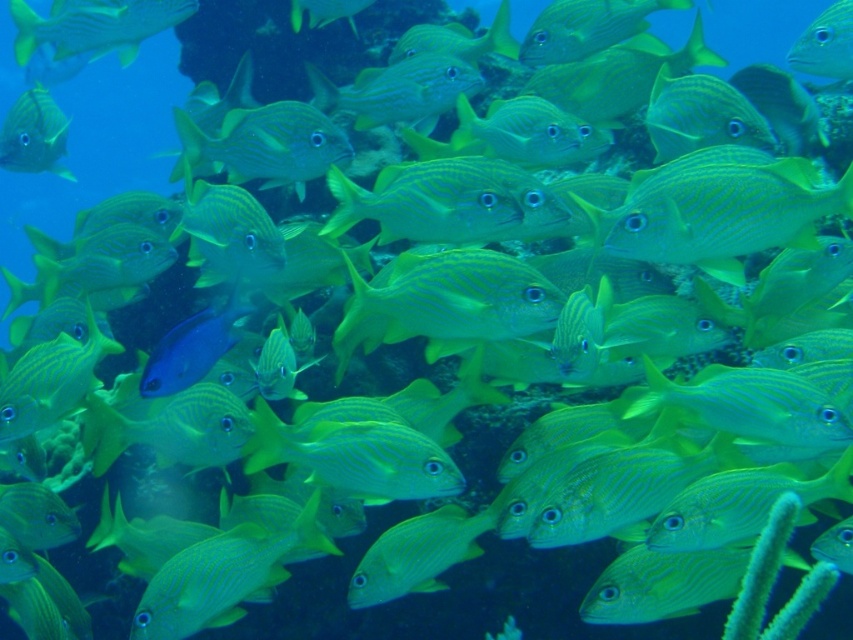
You are a marine biologist observing an underwater scene. You notice a matte yellow fish at upper left and a green striped fish at upper right. Based on their positions, which fish is situated closer to the bottom of the image?

The matte yellow fish at upper left is located below the green striped fish at upper right, so it is closer to the bottom of the image.

You are a diver who wants to take a photo of the striped snappers. You notice two points in your viewfinder at coordinates point [82,44] and point [815,58]. Which point should you focus on to ensure the striped snappers are in sharp focus?

You should focus on point [82,44] because it is closer to the camera than point [815,58], ensuring the striped snappers are in sharp focus.

You are a marine biologist observing the underwater scene. You notice the matte yellow fish at upper left and the green striped fish at upper right. Which fish has a greater width?

The matte yellow fish at upper left might be wider than green striped fish at upper right according to the description.